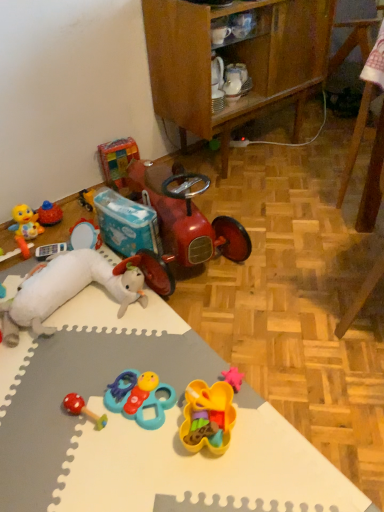
Identify the location of vacant area that lies to the right of rubberized red mushroom rattle at lower left, the 2th toy in the front-to-back sequence. (149, 428).